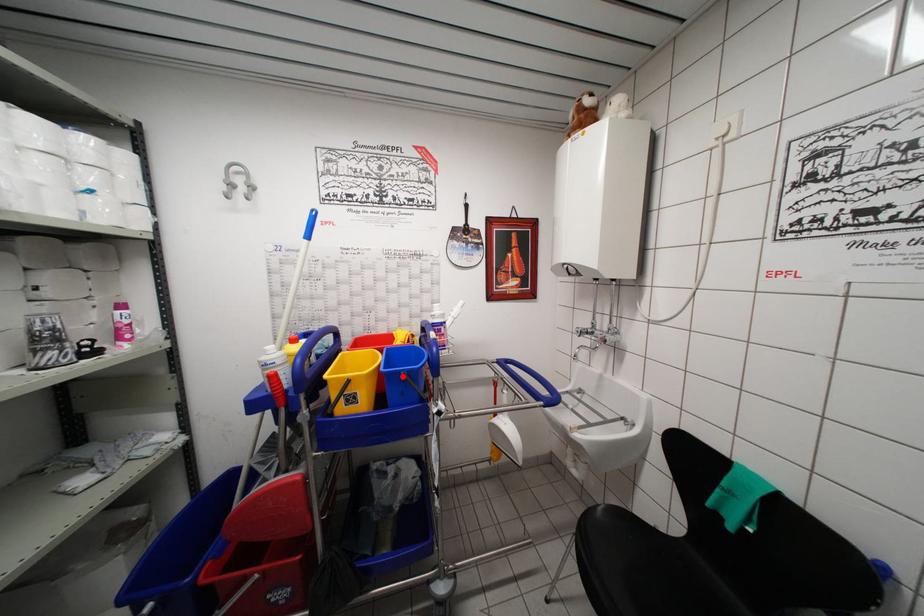
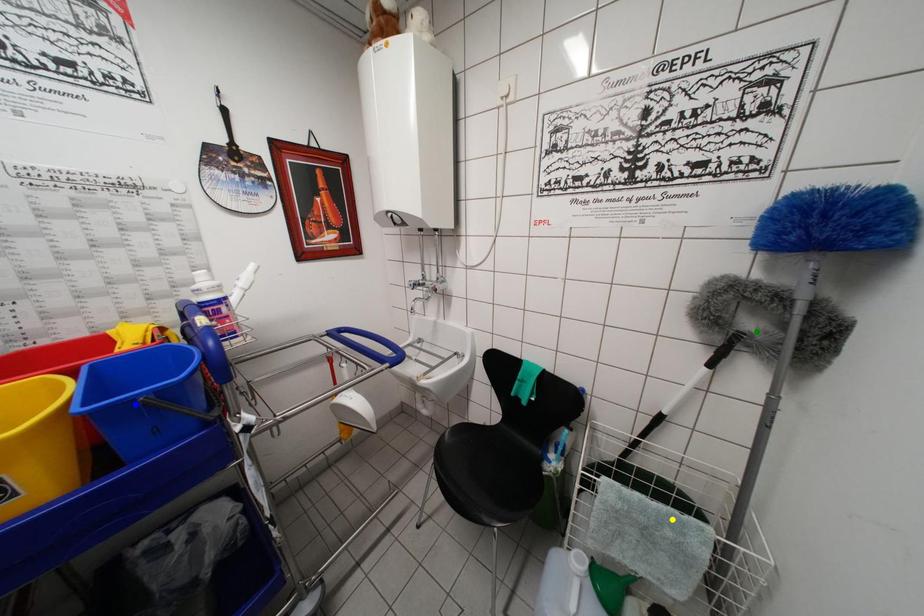
Question: I am providing you with two images of the same scene from different viewpoints. A red point is marked on the first image. You are given multiple points on the second image. In image 2, which mark is for the same physical point as the one in image 1?

Choices:
 (A) yellow point
 (B) blue point
 (C) green point

Answer: (B)